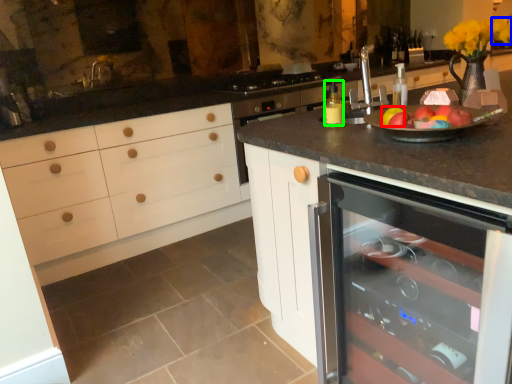
Question: Which object is positioned closest to apple (highlighted by a red box)? Select from flower (highlighted by a blue box) and bottle (highlighted by a green box).

Choices:
 (A) flower
 (B) bottle

Answer: (B)